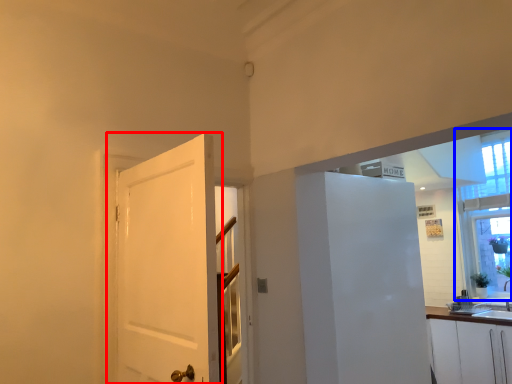
Question: Which object is closer to the camera taking this photo, door (highlighted by a red box) or window (highlighted by a blue box)?

Choices:
 (A) door
 (B) window

Answer: (A)